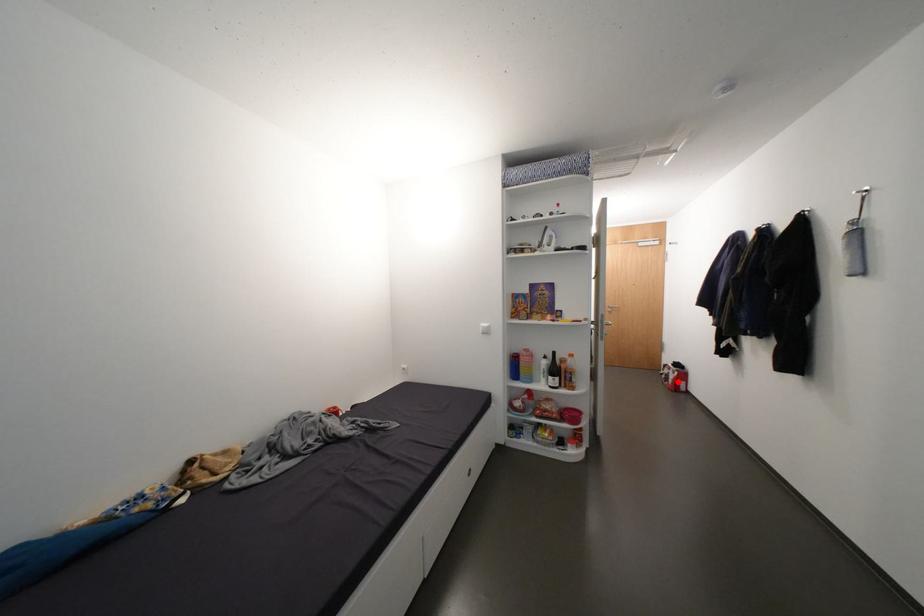
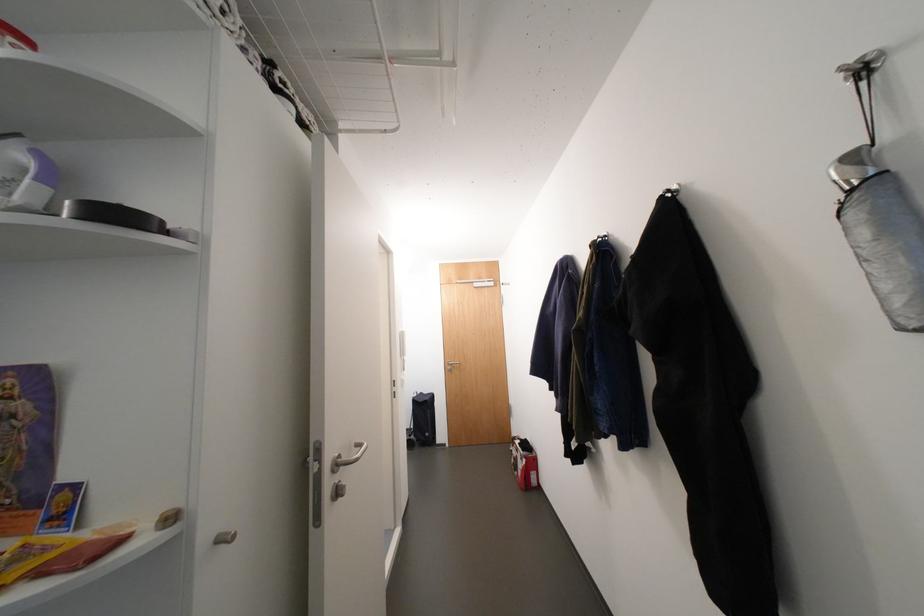
Where in the second image is the point corresponding to the highlighted location from the first image?

(527, 474)